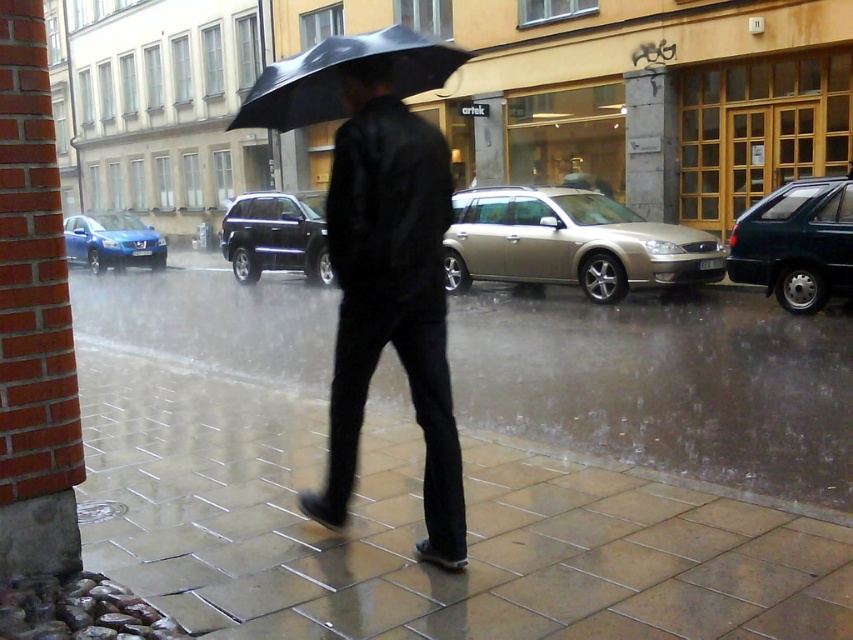
Based on the scene description, can you determine the position of the smooth stone pavement at center relative to the shiny black suv at center?

The smooth stone pavement at center is to the right of the shiny black suv at center.

You are a delivery person carrying a large box that is 2 meters wide. You need to walk across the smooth stone pavement at center. Can you fit through the space between the shiny black suv at center and the building without hitting the car?

The smooth stone pavement at center is wider than the shiny black suv at center, so the 2 meter wide box should fit through the space between them without hitting the car.